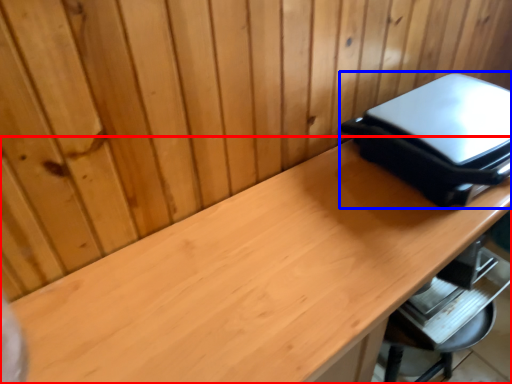
Question: Which point is closer to the camera, desk (highlighted by a red box) or appliance (highlighted by a blue box)?

Choices:
 (A) desk
 (B) appliance

Answer: (A)